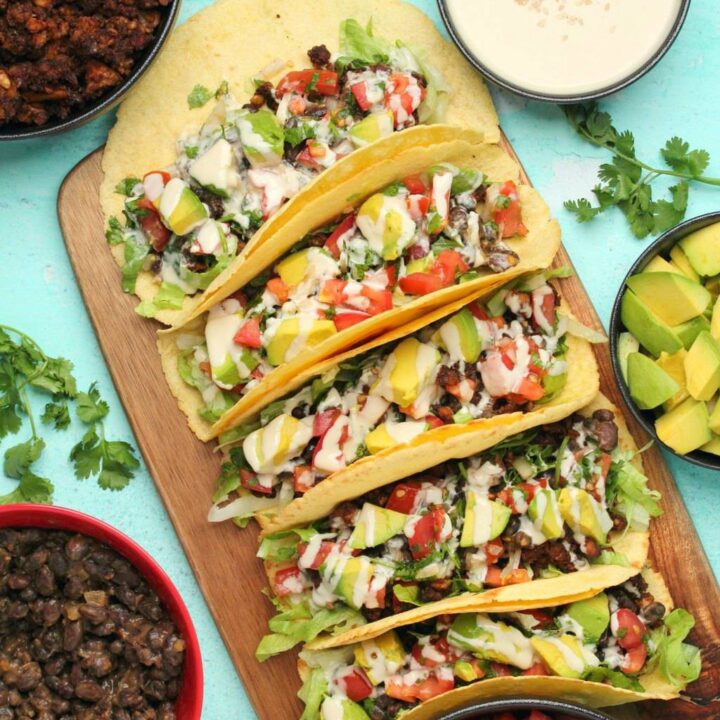
The width and height of the screenshot is (720, 720). I want to click on serving board, so click(126, 340).